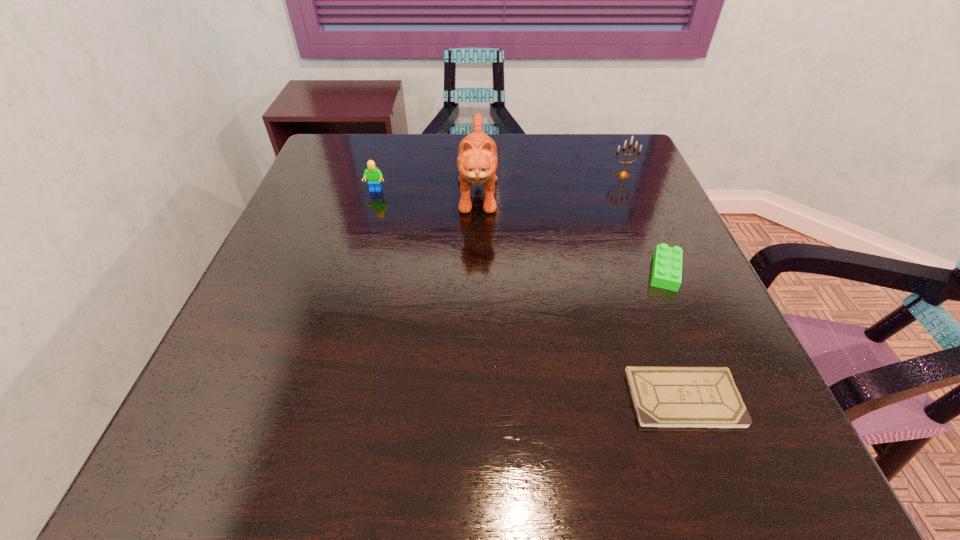
Identify the location of free spot located on the front of the candelabrum. Image resolution: width=960 pixels, height=540 pixels. (670, 287).

At what (x,y) coordinates should I click in order to perform the action: click on free space located on the face of the farther Lego. Please return your answer as a coordinate pair (x, y). The width and height of the screenshot is (960, 540). Looking at the image, I should click on (367, 222).

Locate an element on the screen. Image resolution: width=960 pixels, height=540 pixels. vacant space positioned on the left of the shorter Lego is located at coordinates coord(560,272).

I want to click on vacant area located on the left of the nearest object, so click(x=601, y=399).

At what (x,y) coordinates should I click in order to perform the action: click on cat at the far edge. Please return your answer as a coordinate pair (x, y). The image size is (960, 540). Looking at the image, I should click on (477, 161).

Find the location of a particular element. This screenshot has height=540, width=960. candelabrum that is positioned at the far edge is located at coordinates (623, 174).

At what (x,y) coordinates should I click in order to perform the action: click on candelabrum that is at the right edge. Please return your answer as a coordinate pair (x, y). The width and height of the screenshot is (960, 540). Looking at the image, I should click on (623, 174).

Locate an element on the screen. The height and width of the screenshot is (540, 960). Lego present at the right edge is located at coordinates (667, 262).

Image resolution: width=960 pixels, height=540 pixels. I want to click on checkbook present at the right edge, so click(664, 397).

Identify the location of object present at the far right corner. (623, 174).